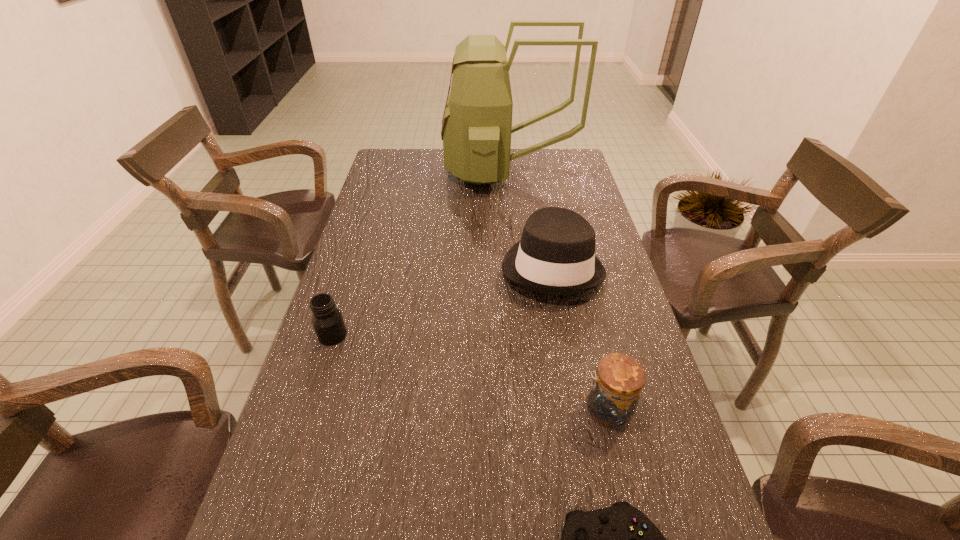
This screenshot has width=960, height=540. Identify the location of free point that satisfies the following two spatial constraints: 1. on the front pocket of the fedora; 2. on the left side of the tallest object. (516, 266).